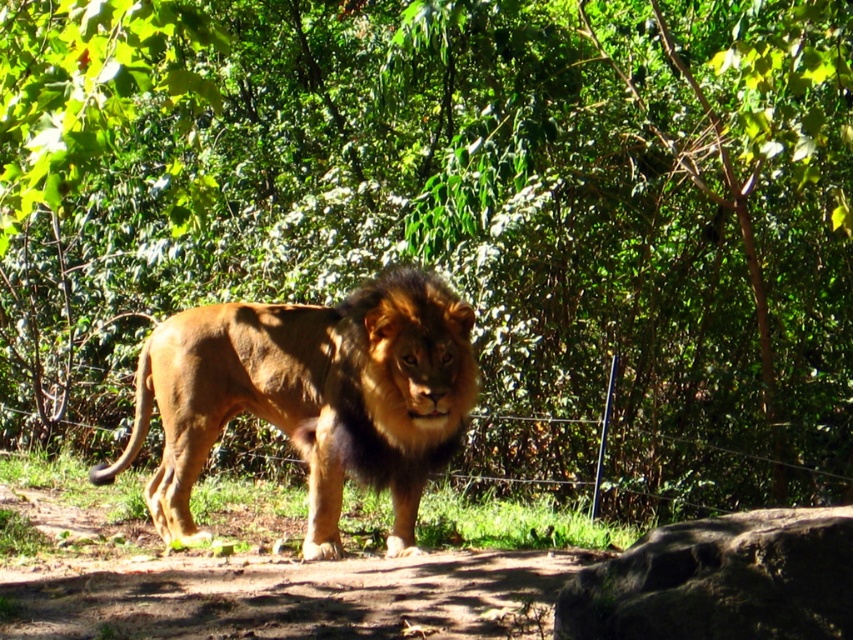
You are a zookeeper who needs to place a new feeding bowl for the golden fur lion at center. The bowl must be placed on the brown rough rock at lower right. Is the rock a suitable location for the bowl?

The golden fur lion at center is located above the brown rough rock at lower right, meaning the rock is positioned below the lion. Since the rock is below the lion, it is a suitable location to place the feeding bowl as it is within the lion enclosure and accessible to the lion.

Looking at this image, you are a zookeeper trying to place a new feeding tray between the golden fur lion at center and the brown rough rock at lower right. The feeding tray is 1.2 meters wide. Can the tray fit between them without touching either object?

The golden fur lion at center is wider than the brown rough rock at lower right. However, the description does not provide the exact distance between them, so it is impossible to determine if the feeding tray can fit without additional information about the space available between the two objects.